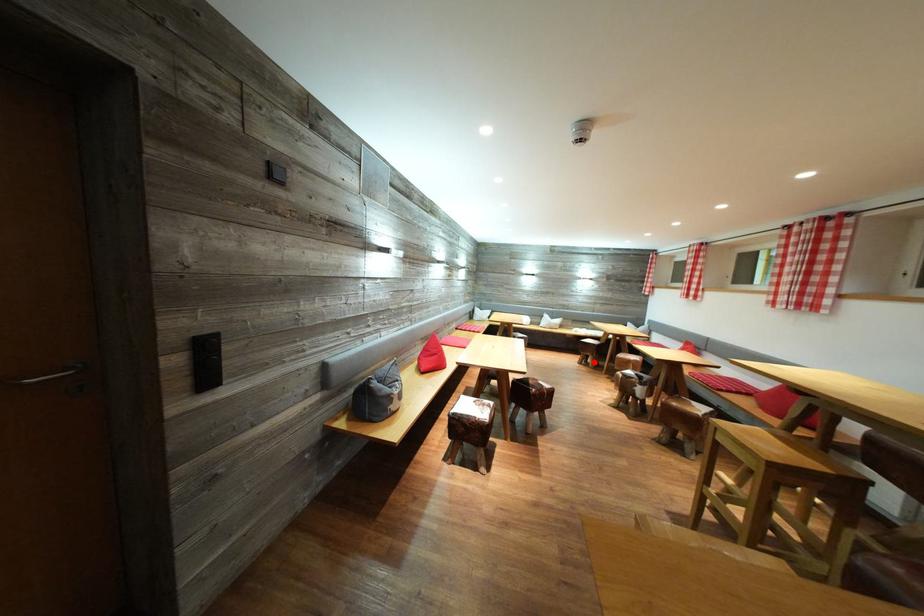
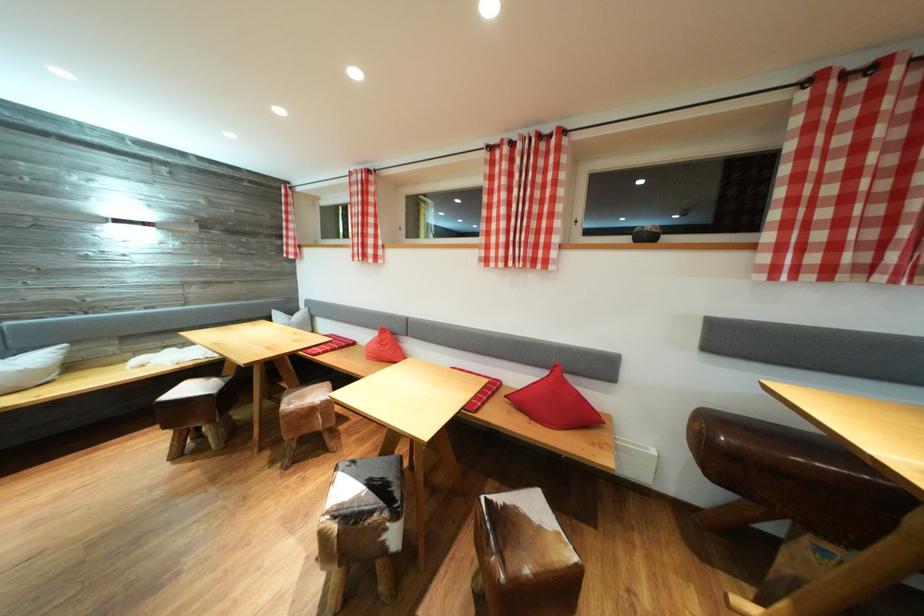
The point at the highlighted location is marked in the first image. Where is the corresponding point in the second image?

(203, 434)